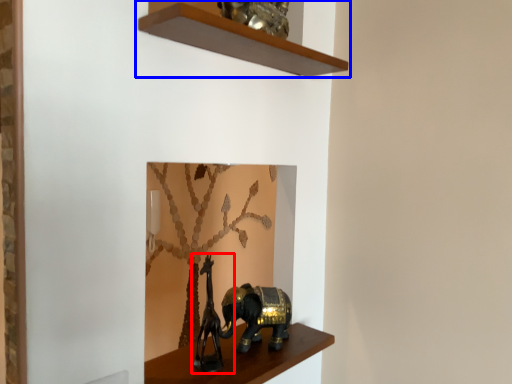
Question: Among these objects, which one is nearest to the camera, animal sculpture (highlighted by a red box) or shelf (highlighted by a blue box)?

Choices:
 (A) animal sculpture
 (B) shelf

Answer: (B)